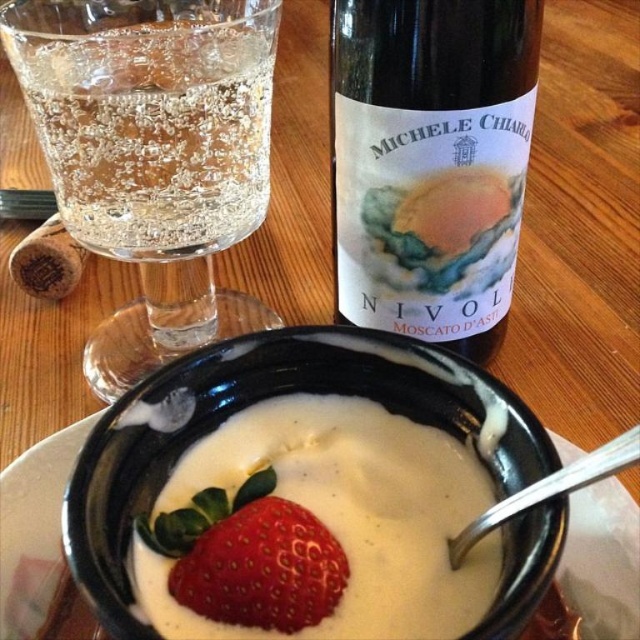
Question: Is clear glass wine glass at upper left closer to camera compared to matte black bowl at center?

Choices:
 (A) no
 (B) yes

Answer: (A)

Question: Which object appears farthest from the camera in this image?

Choices:
 (A) dark brown glass bottle at upper right
 (B) matte black bowl at center
 (C) clear glass wine glass at upper left
 (D) shiny red strawberry at center

Answer: (A)

Question: Does clear glass wine glass at upper left have a larger size compared to shiny red strawberry at center?

Choices:
 (A) no
 (B) yes

Answer: (B)

Question: Which of the following is the closest to the observer?

Choices:
 (A) (355, 97)
 (B) (244, 528)

Answer: (B)

Question: Can you confirm if clear glass wine glass at upper left is bigger than matte black bowl at center?

Choices:
 (A) yes
 (B) no

Answer: (A)

Question: Among these objects, which one is nearest to the camera?

Choices:
 (A) matte black bowl at center
 (B) shiny red strawberry at center
 (C) clear glass wine glass at upper left
 (D) dark brown glass bottle at upper right

Answer: (A)